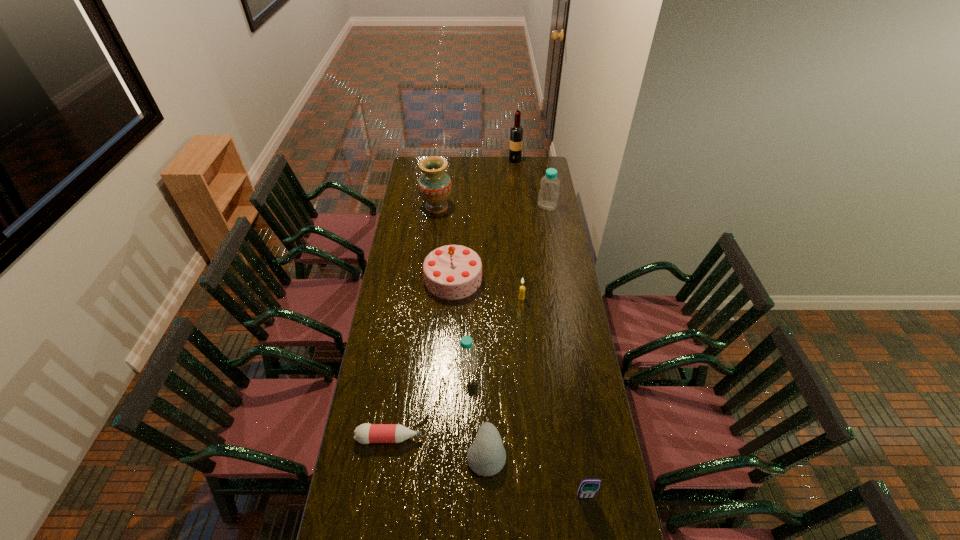
In order to click on beanie in this screenshot , I will do `click(486, 456)`.

Locate an element on the screen. This screenshot has width=960, height=540. the nearest bottle is located at coordinates (366, 433).

Where is `the shortest object`? The width and height of the screenshot is (960, 540). the shortest object is located at coordinates (366, 433).

Locate an element on the screen. vacant space situated 0.100m on the right of the wine bottle is located at coordinates (537, 160).

You are a GUI agent. You are given a task and a screenshot of the screen. Output one action in this format:
    pyautogui.click(x=<x>, y=<y>)
    Task: Click on the free space located on the right of the eighth shortest object
    The width and height of the screenshot is (960, 540).
    Given the screenshot: What is the action you would take?
    pyautogui.click(x=472, y=207)

Locate an element on the screen. vacant space positioned 0.130m on the front of the bigger blue bottle is located at coordinates (550, 226).

The height and width of the screenshot is (540, 960). Identify the location of vacant space located 0.310m on the right of the birthday cake. (546, 278).

At what (x,y) coordinates should I click in order to perform the action: click on free space located on the left of the second shortest bottle. Please return your answer as a coordinate pair (x, y). This screenshot has width=960, height=540. Looking at the image, I should click on (394, 366).

You are a GUI agent. You are given a task and a screenshot of the screen. Output one action in this format:
    pyautogui.click(x=<x>, y=<y>)
    Task: Click on the vacant space located on the right of the cream candle
    This screenshot has height=540, width=960.
    Given the screenshot: What is the action you would take?
    pyautogui.click(x=564, y=298)

Where is `free space located on the front-facing side of the nearest object`? free space located on the front-facing side of the nearest object is located at coordinates (588, 523).